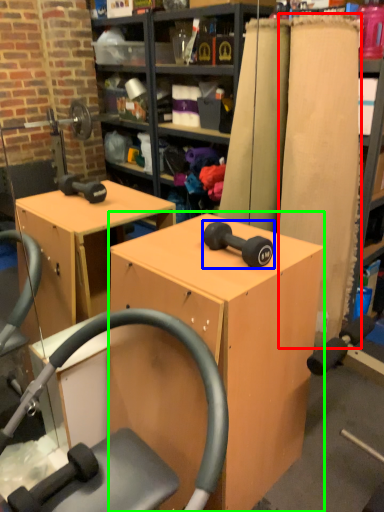
Question: Which object is positioned closest to plank (highlighted by a red box)? Select from dumbbell (highlighted by a blue box) and furniture (highlighted by a green box).

Choices:
 (A) dumbbell
 (B) furniture

Answer: (B)